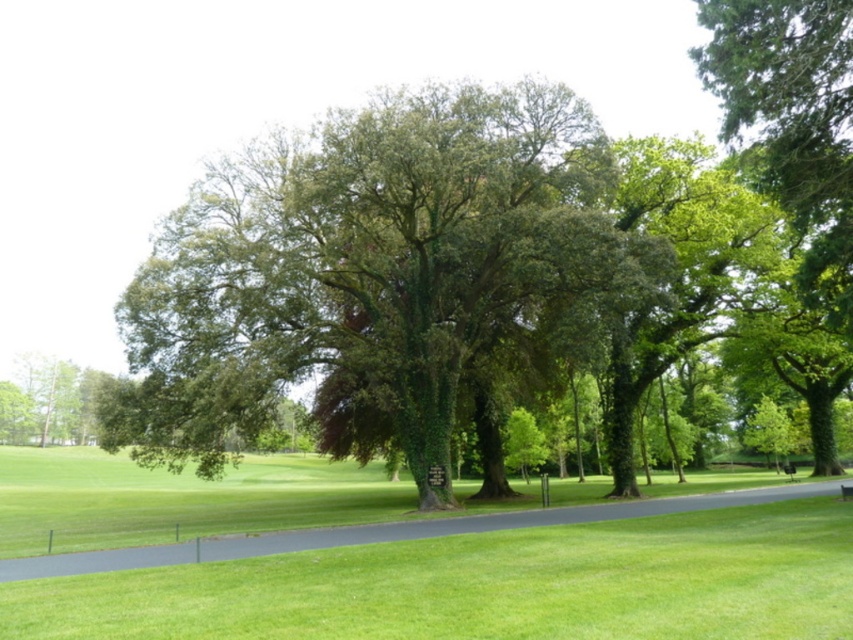
Question: Which is nearer to the black asphalt path at center?

Choices:
 (A) green leafy tree at lower left
 (B) wooden park bench at center
 (C) green leafy tree at center

Answer: (B)

Question: Which point appears closest to the camera in this image?

Choices:
 (A) (834, 160)
 (B) (96, 385)

Answer: (A)

Question: Is green leafy tree at upper right to the right of black asphalt path at center from the viewer's perspective?

Choices:
 (A) no
 (B) yes

Answer: (B)

Question: Estimate the real-world distances between objects in this image. Which object is closer to the green leafy tree at lower left?

Choices:
 (A) green leafy tree at center
 (B) black asphalt path at center
 (C) green leafy tree at upper right
 (D) wooden park bench at center

Answer: (A)

Question: Does green leafy tree at center appear on the left side of green leafy tree at upper right?

Choices:
 (A) no
 (B) yes

Answer: (B)

Question: Does green leafy tree at center appear under green leafy tree at lower left?

Choices:
 (A) yes
 (B) no

Answer: (B)